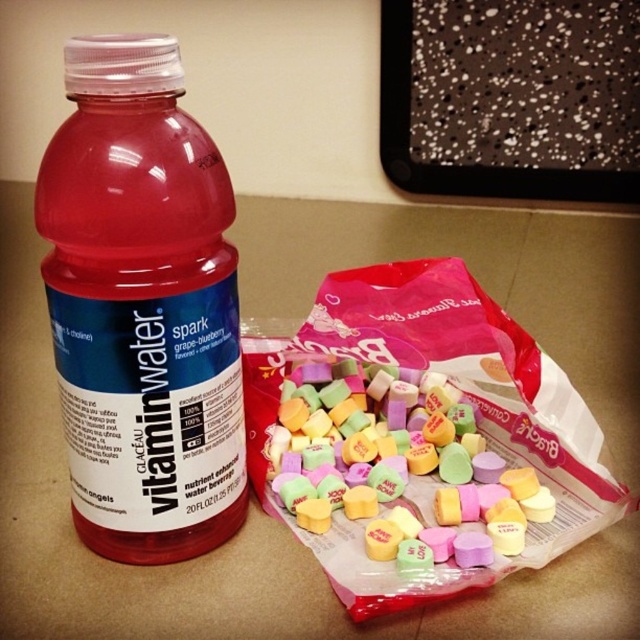
Question: Which object appears farthest from the camera in this image?

Choices:
 (A) pastel heart-shaped candies at center
 (B) matte plastic vitaminwater at left

Answer: (A)

Question: Is translucent plastic bag of heart-shaped candies at lower right wider than matte plastic vitaminwater at left?

Choices:
 (A) no
 (B) yes

Answer: (B)

Question: Which point appears closest to the camera in this image?

Choices:
 (A) tap(346, 422)
 (B) tap(547, 397)

Answer: (B)

Question: Observing the image, what is the correct spatial positioning of translucent plastic bag of heart-shaped candies at lower right in reference to matte plastic vitaminwater at left?

Choices:
 (A) right
 (B) left

Answer: (A)

Question: Considering the relative positions of translucent plastic bag of heart-shaped candies at lower right and pastel heart-shaped candies at center in the image provided, where is translucent plastic bag of heart-shaped candies at lower right located with respect to pastel heart-shaped candies at center?

Choices:
 (A) left
 (B) right

Answer: (A)

Question: Which point is closer to the camera?

Choices:
 (A) (522, 388)
 (B) (444, 522)

Answer: (A)